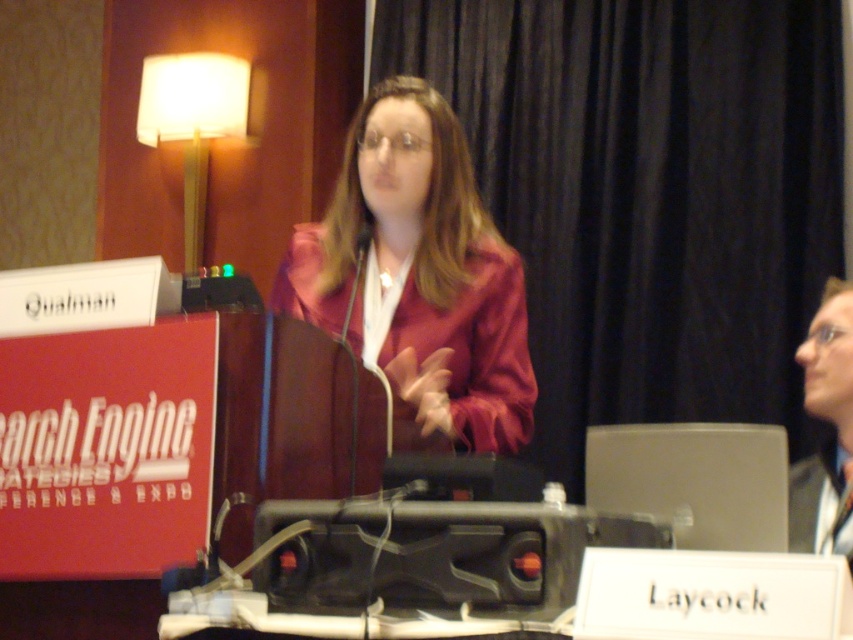
Question: Can you confirm if satin red jacket at center is wider than matte black laptop at upper right?

Choices:
 (A) no
 (B) yes

Answer: (B)

Question: Which object is positioned farthest from the white fabric lampshade at upper left?

Choices:
 (A) satin silver laptop at center
 (B) matte black laptop at upper right
 (C) satin red jacket at center

Answer: (B)

Question: Observing the image, what is the correct spatial positioning of satin red jacket at center in reference to matte black laptop at upper right?

Choices:
 (A) right
 (B) left

Answer: (B)

Question: Which object is the farthest from the white fabric lampshade at upper left?

Choices:
 (A) satin red jacket at center
 (B) matte black laptop at upper right

Answer: (B)

Question: Which of the following is the farthest from the observer?

Choices:
 (A) matte black laptop at upper right
 (B) white fabric lampshade at upper left
 (C) satin silver laptop at center
 (D) satin red jacket at center

Answer: (B)

Question: Can you confirm if white fabric lampshade at upper left is bigger than matte black laptop at upper right?

Choices:
 (A) yes
 (B) no

Answer: (B)